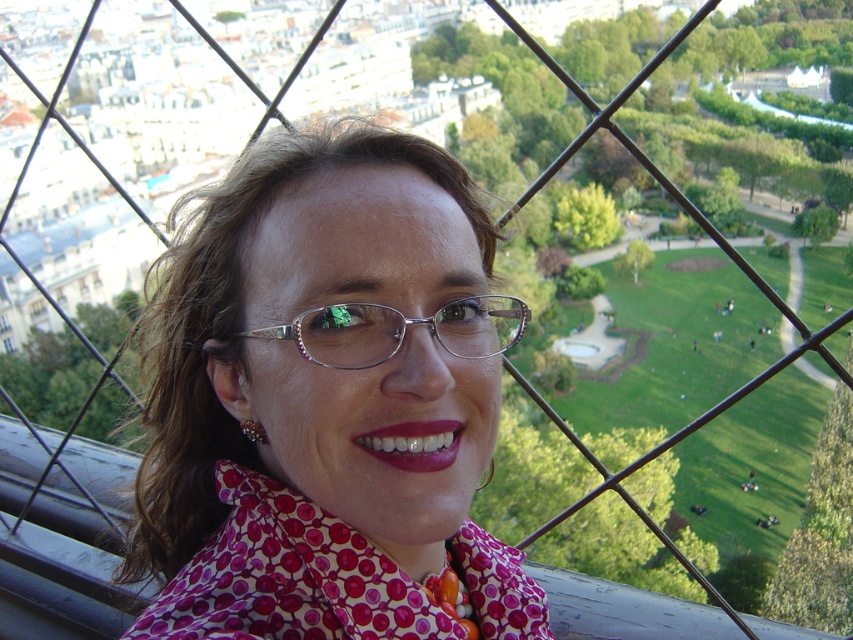
Consider the image. Can you confirm if pink dotted shirt at center is positioned to the right of metallic silver glasses at center?

Incorrect, pink dotted shirt at center is not on the right side of metallic silver glasses at center.

Is point (451, 445) positioned before point (495, 344)?

Yes, point (451, 445) is in front of point (495, 344).

What do you see at coordinates (326, 403) in the screenshot?
I see `pink dotted shirt at center` at bounding box center [326, 403].

This screenshot has width=853, height=640. What are the coordinates of `pink dotted shirt at center` in the screenshot? It's located at (326, 403).